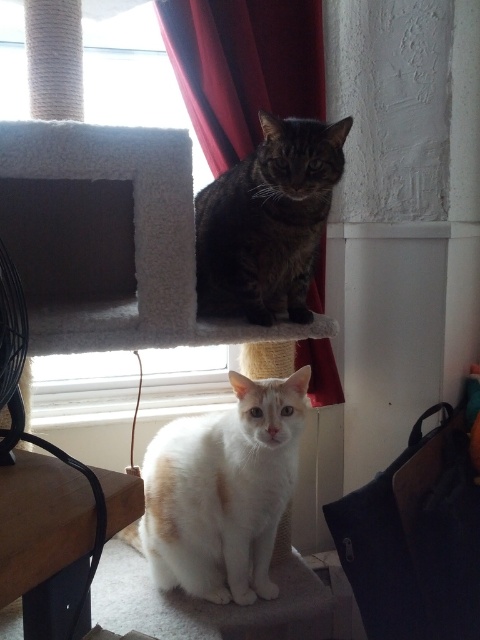
Does white fluffy cat at lower center have a lesser height compared to red velvet curtain at upper center?

Incorrect, white fluffy cat at lower center's height does not fall short of red velvet curtain at upper center's.

Does point (264, 538) lie behind point (200, 136)?

No, (264, 538) is in front of (200, 136).

This screenshot has width=480, height=640. Identify the location of white fluffy cat at lower center. (222, 492).

Which is behind, point (153, 509) or point (224, 314)?

The point (224, 314) is behind.

Does point (257, 557) come behind point (268, 268)?

Yes.

Who is more forward, (220, 509) or (231, 282)?

Point (220, 509) is in front.

Find the location of `white fluffy cat at lower center`. white fluffy cat at lower center is located at coordinates (222, 492).

Between point (292, 61) and point (240, 227), which one is positioned behind?

Point (292, 61)

Does red velvet curtain at upper center have a smaller size compared to tabby fur cat at upper center?

Actually, red velvet curtain at upper center might be larger than tabby fur cat at upper center.

Does point (312, 364) lie in front of point (324, 188)?

No, it is behind (324, 188).

The image size is (480, 640). In order to click on red velvet curtain at upper center in this screenshot , I will do `click(243, 67)`.